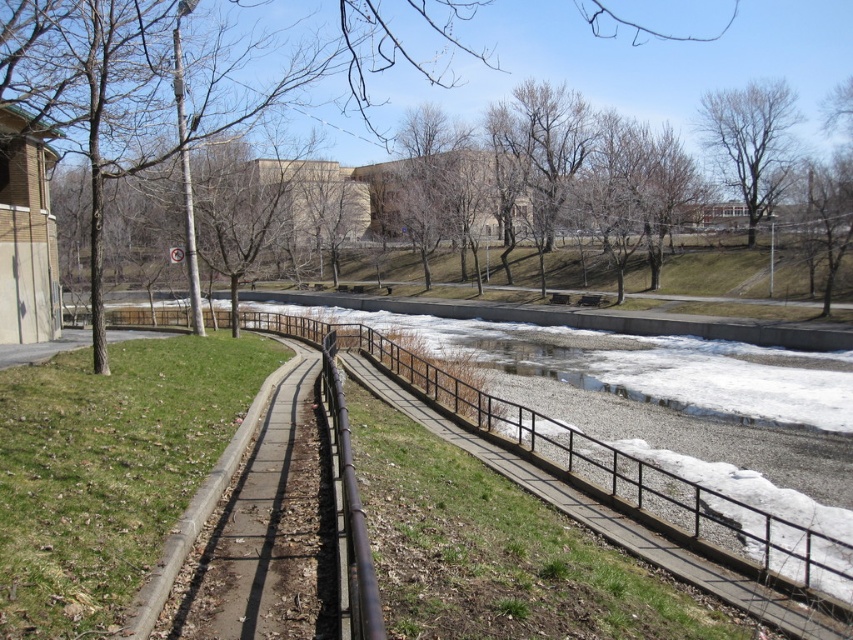
You are standing at the starting point of the pathway and want to locate the brown leafless tree at upper center. According to the scene description, where should you look relative to your position?

The brown leafless tree at upper center is located at the 2D coordinates point of (192,77) in the scene, so you should look towards the upper center area of the image.